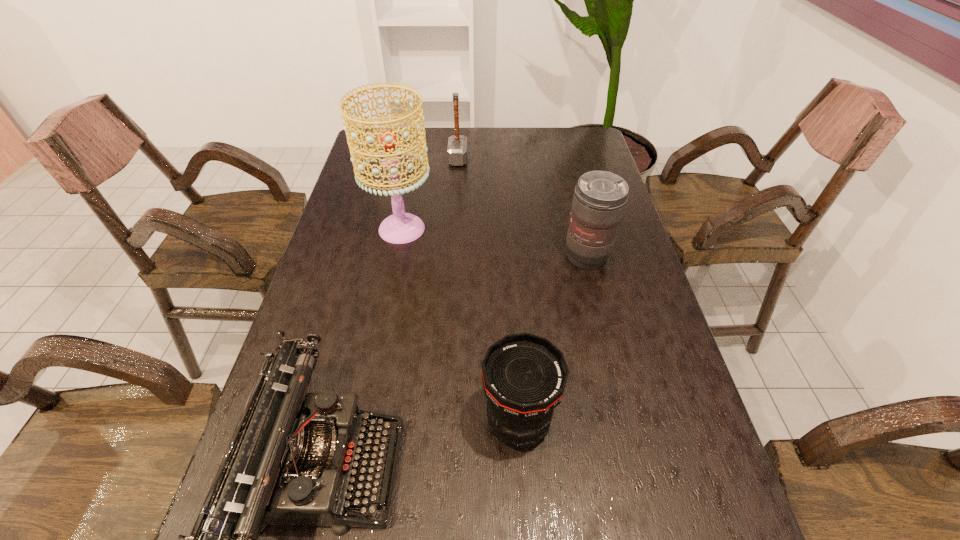
Image resolution: width=960 pixels, height=540 pixels. What are the coordinates of `unoccupied position between the fourth object from left to right and the lampshade` in the screenshot? It's located at (460, 326).

I want to click on vacant space that's between the third object from left to right and the nearer telephoto lens, so click(x=488, y=291).

Locate an element on the screen. object that is the second closest to the typewriter is located at coordinates (400, 228).

Locate an element on the screen. Image resolution: width=960 pixels, height=540 pixels. object that is the closest to the taller telephoto lens is located at coordinates 524,376.

Where is `blank space that satisfies the following two spatial constraints: 1. on the striking surface of the second shortest object; 2. on the left side of the hammer`? The height and width of the screenshot is (540, 960). blank space that satisfies the following two spatial constraints: 1. on the striking surface of the second shortest object; 2. on the left side of the hammer is located at coordinates (441, 423).

Identify the location of blank space that satisfies the following two spatial constraints: 1. on the striking surface of the fourth tallest object; 2. on the right side of the third object from left to right. The width and height of the screenshot is (960, 540). (441, 423).

This screenshot has width=960, height=540. What are the coordinates of `vacant space that satisfies the following two spatial constraints: 1. on the striking surface of the farthest object; 2. on the back side of the nearer telephoto lens` in the screenshot? It's located at (441, 423).